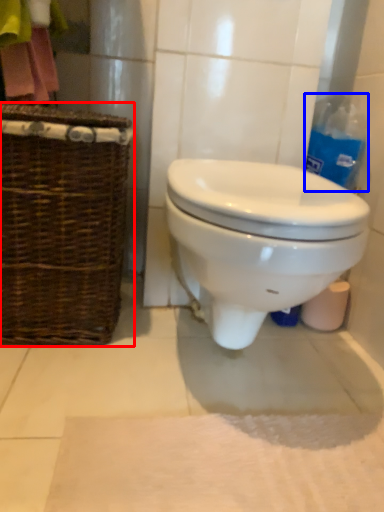
Question: Which object is closer to the camera taking this photo, picnic basket (highlighted by a red box) or cleaning product (highlighted by a blue box)?

Choices:
 (A) picnic basket
 (B) cleaning product

Answer: (A)